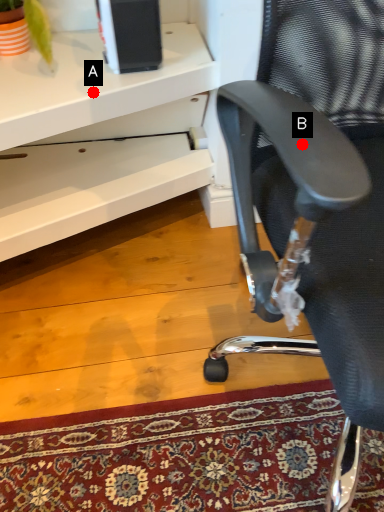
Question: Two points are circled on the image, labeled by A and B beside each circle. Which of the following is the closest to the observer?

Choices:
 (A) A is closer
 (B) B is closer

Answer: (B)